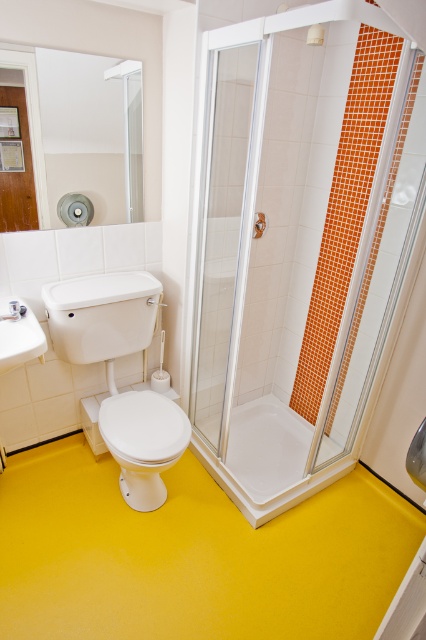
You are standing in the bathroom and need to access the transparent glass shower door at center. Based on the layout described, which direction should you move relative to the toilet to reach it?

The transparent glass shower door at center is located at point coordinates that are to the right of the toilet, so you should move to the right of the toilet to reach it.

In the scene shown: You are a delivery person who needs to bring a 2.5 feet wide package through the bathroom. The package must pass between the clear glass shower door at center and the white glossy sink at lower left. Can the package fit through the space between them?

The clear glass shower door at center is wider than the white glossy sink at lower left. Since the package is 2.5 feet wide, it depends on the actual width of the space between them. However, since the shower door is wider, the space might be sufficient. Without exact measurements, it is uncertain.